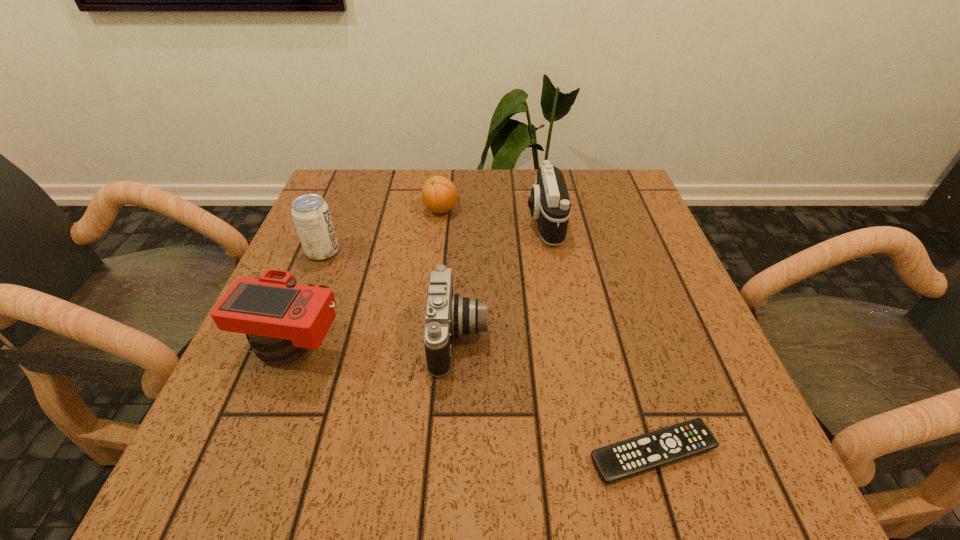
Locate an element on the screen. The width and height of the screenshot is (960, 540). object situated at the right edge is located at coordinates (623, 459).

Identify the location of object present at the near right corner. The width and height of the screenshot is (960, 540). (623, 459).

In the image, there is a desktop. Identify the location of free space at the far edge. (397, 183).

This screenshot has width=960, height=540. In the image, there is a desktop. Identify the location of vacant space at the near edge. (331, 470).

Find the location of `vacant space at the left edge of the desktop`. vacant space at the left edge of the desktop is located at coordinates (237, 372).

The image size is (960, 540). In the image, there is a desktop. In order to click on vacant area at the right edge in this screenshot , I will do `click(656, 343)`.

At what (x,y) coordinates should I click in order to perform the action: click on free space at the far left corner of the desktop. Please return your answer as a coordinate pair (x, y). The image size is (960, 540). Looking at the image, I should click on (356, 181).

I want to click on empty space that is in between the leftmost camera and the orange, so click(x=369, y=278).

Locate an element on the screen. The height and width of the screenshot is (540, 960). free space that is in between the nearest object and the second camera from right to left is located at coordinates (556, 395).

This screenshot has width=960, height=540. Find the location of `free space between the soda can and the shortest object`. free space between the soda can and the shortest object is located at coordinates (488, 352).